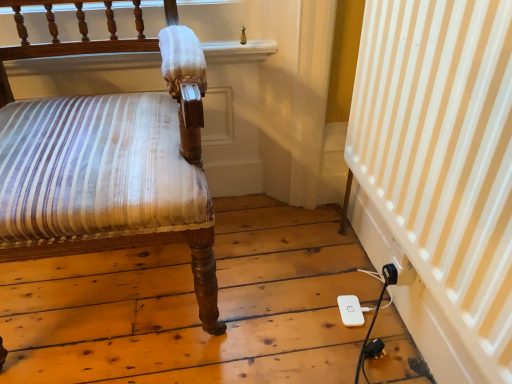
Find the location of `vacant space underneath white striped curtain at lower right (from a real-world perspective)`. vacant space underneath white striped curtain at lower right (from a real-world perspective) is located at coordinates (380, 304).